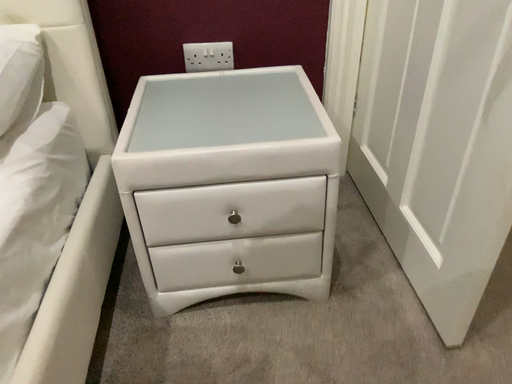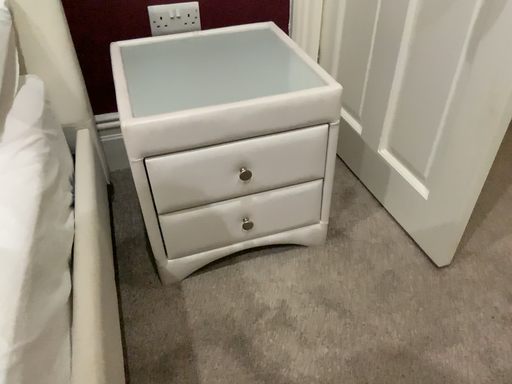
Question: How did the camera likely rotate when shooting the video?

Choices:
 (A) rotated left
 (B) rotated right

Answer: (B)